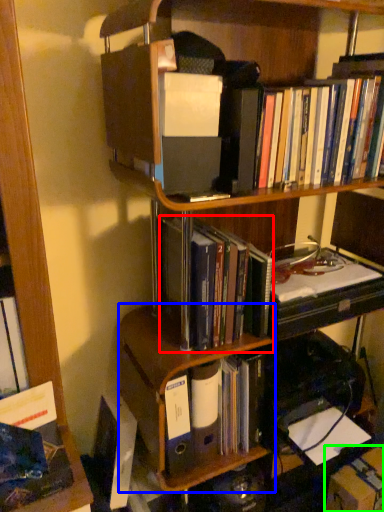
Question: Based on their relative distances, which object is farther from book (highlighted by a red box)? Choose from shelf (highlighted by a blue box) and cardboard box (highlighted by a green box).

Choices:
 (A) shelf
 (B) cardboard box

Answer: (B)